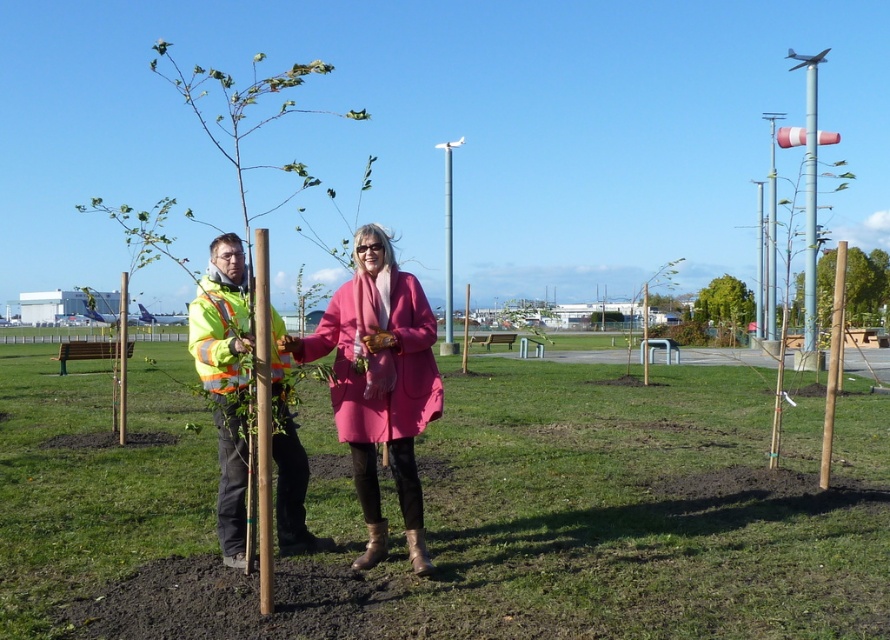
Question: Is matte yellow jacket at center to the right of green leafy tree at center from the viewer's perspective?

Choices:
 (A) no
 (B) yes

Answer: (A)

Question: Which of the following is the closest to the observer?

Choices:
 (A) (450, 141)
 (B) (719, 310)

Answer: (B)

Question: Which object appears closest to the camera in this image?

Choices:
 (A) brushed metal pole at center
 (B) brown wood pole at center
 (C) metallic pole at center
 (D) high visibility jacket at center

Answer: (B)

Question: Based on their relative distances, which object is farther from the brown wood pole at center?

Choices:
 (A) metallic pole at center
 (B) green leafy tree at center
 (C) matte yellow jacket at center
 (D) high visibility jacket at center

Answer: (B)

Question: Observing the image, what is the correct spatial positioning of matte yellow jacket at center in reference to green matte pole at upper right?

Choices:
 (A) above
 (B) below

Answer: (B)

Question: Is matte yellow jacket at center to the left of high visibility jacket at center from the viewer's perspective?

Choices:
 (A) yes
 (B) no

Answer: (B)